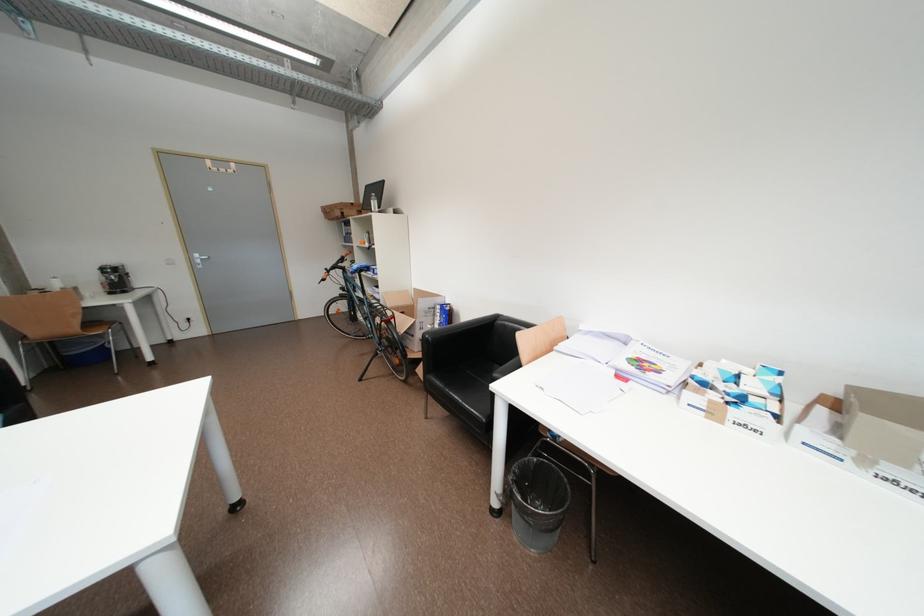
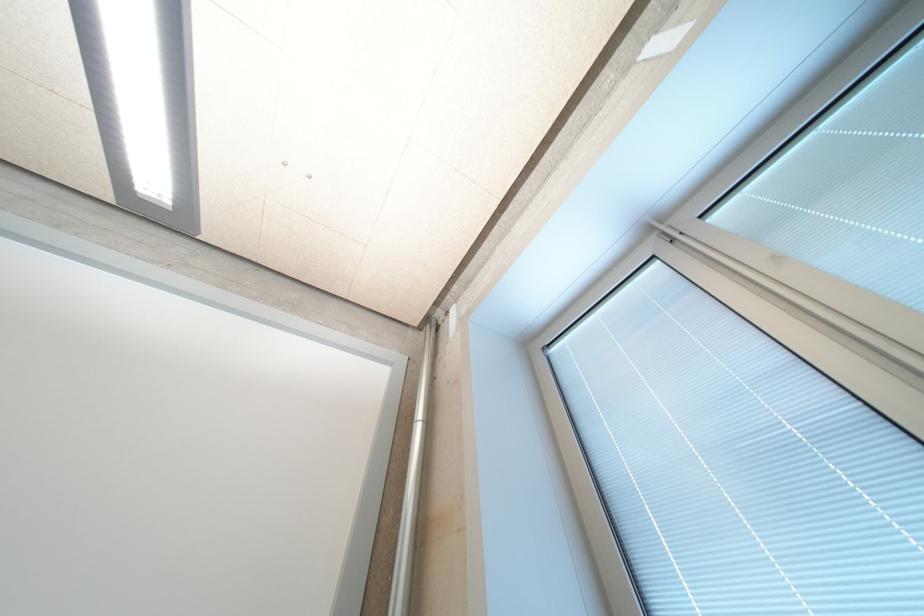
The first image is from the beginning of the video and the second image is from the end. How did the camera likely rotate when shooting the video?

The rotation direction of the camera is right-up.